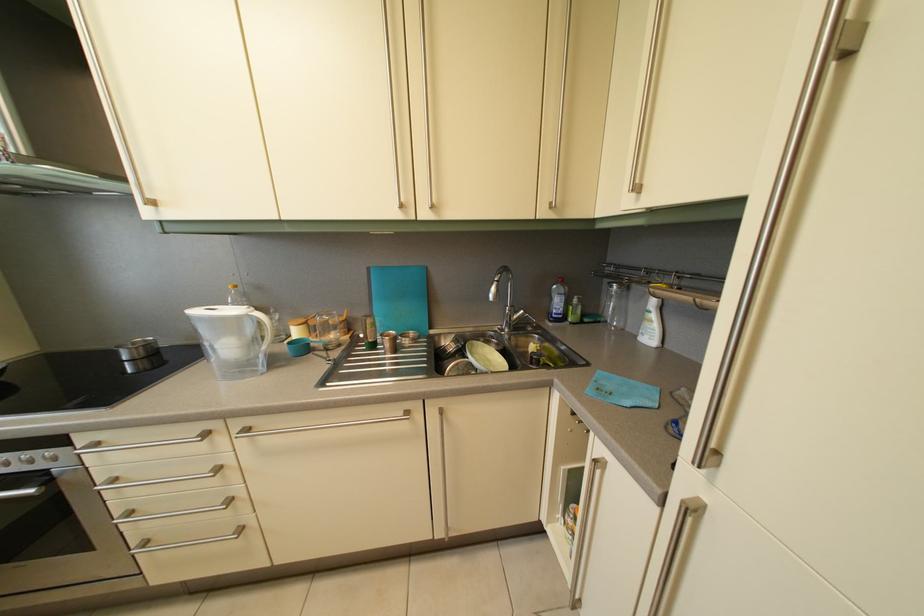
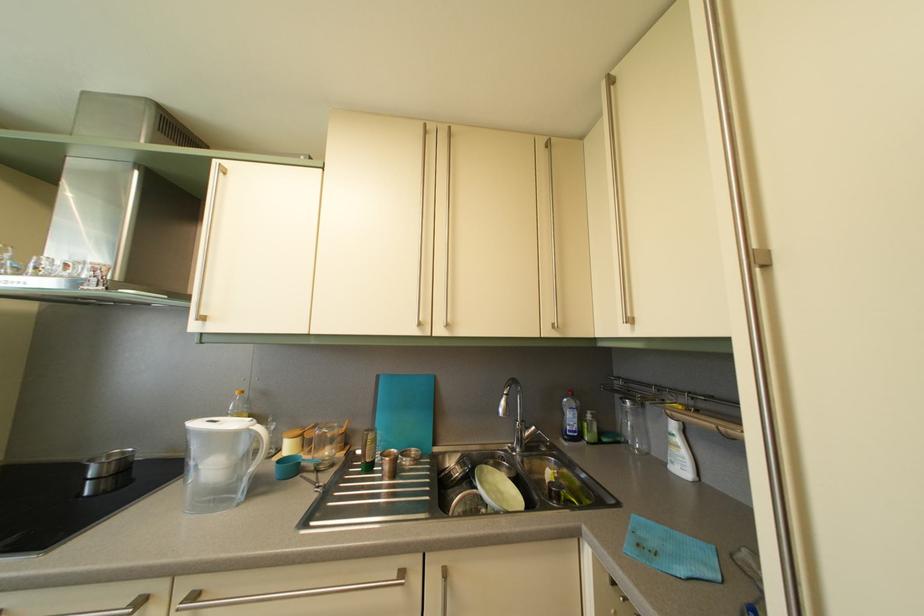
Where in the second image is the point corresponding to point (519, 314) from the first image?

(530, 429)